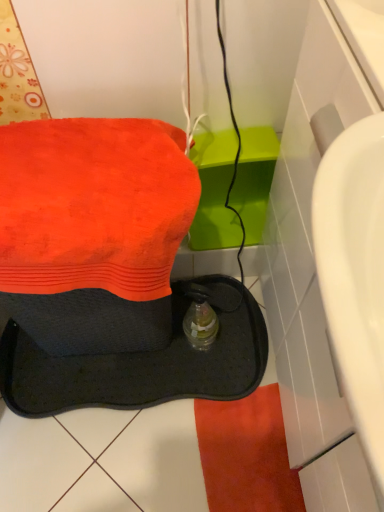
Question: Is orange terry towel at upper left taller than translucent plastic bottle at center?

Choices:
 (A) no
 (B) yes

Answer: (A)

Question: From the image's perspective, is orange terry towel at upper left located above translucent plastic bottle at center?

Choices:
 (A) no
 (B) yes

Answer: (B)

Question: Is orange terry towel at upper left to the right of translucent plastic bottle at center from the viewer's perspective?

Choices:
 (A) yes
 (B) no

Answer: (B)

Question: Is orange terry towel at upper left facing away from translucent plastic bottle at center?

Choices:
 (A) no
 (B) yes

Answer: (A)

Question: Is orange terry towel at upper left outside translucent plastic bottle at center?

Choices:
 (A) no
 (B) yes

Answer: (B)

Question: Is orange terry towel at upper left taller or shorter than translucent plastic bottle at center?

Choices:
 (A) tall
 (B) short

Answer: (B)

Question: Considering the positions of point tap(43, 167) and point tap(211, 334), is point tap(43, 167) closer or farther from the camera than point tap(211, 334)?

Choices:
 (A) closer
 (B) farther

Answer: (A)

Question: Considering the positions of orange terry towel at upper left and translucent plastic bottle at center in the image, is orange terry towel at upper left wider or thinner than translucent plastic bottle at center?

Choices:
 (A) thin
 (B) wide

Answer: (B)

Question: From a real-world perspective, is orange terry towel at upper left physically located above or below translucent plastic bottle at center?

Choices:
 (A) above
 (B) below

Answer: (A)

Question: Would you say translucent plastic bottle at center is to the left or to the right of black rubber sink at lower left in the picture?

Choices:
 (A) right
 (B) left

Answer: (A)

Question: Considering the positions of translucent plastic bottle at center and black rubber sink at lower left in the image, is translucent plastic bottle at center taller or shorter than black rubber sink at lower left?

Choices:
 (A) short
 (B) tall

Answer: (A)

Question: Is translucent plastic bottle at center wider or thinner than black rubber sink at lower left?

Choices:
 (A) thin
 (B) wide

Answer: (A)

Question: Is point (206, 302) closer or farther from the camera than point (23, 375)?

Choices:
 (A) farther
 (B) closer

Answer: (A)

Question: From the image's perspective, relative to orange terry towel at upper left, is black rubber sink at lower left above or below?

Choices:
 (A) above
 (B) below

Answer: (B)

Question: Relative to orange terry towel at upper left, is black rubber sink at lower left in front or behind?

Choices:
 (A) front
 (B) behind

Answer: (A)